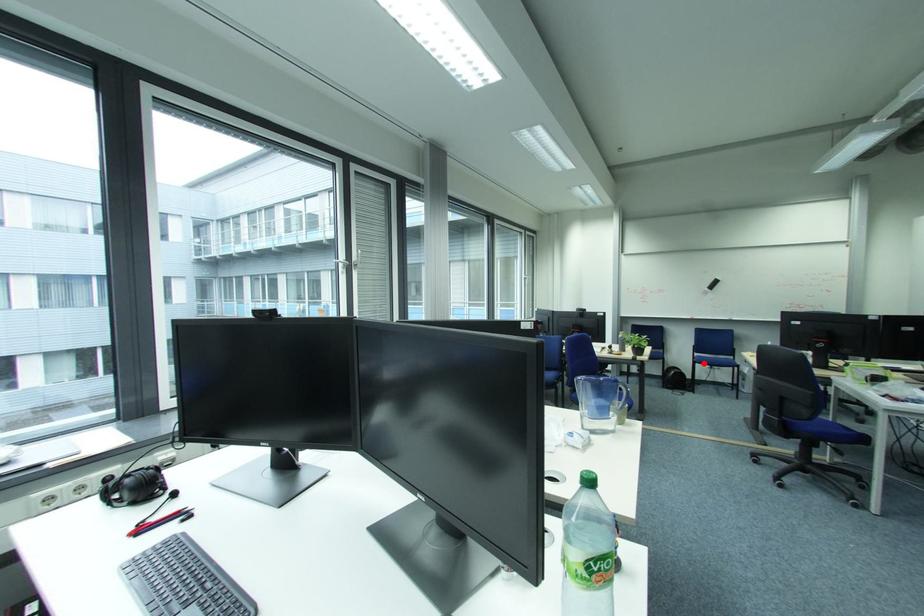
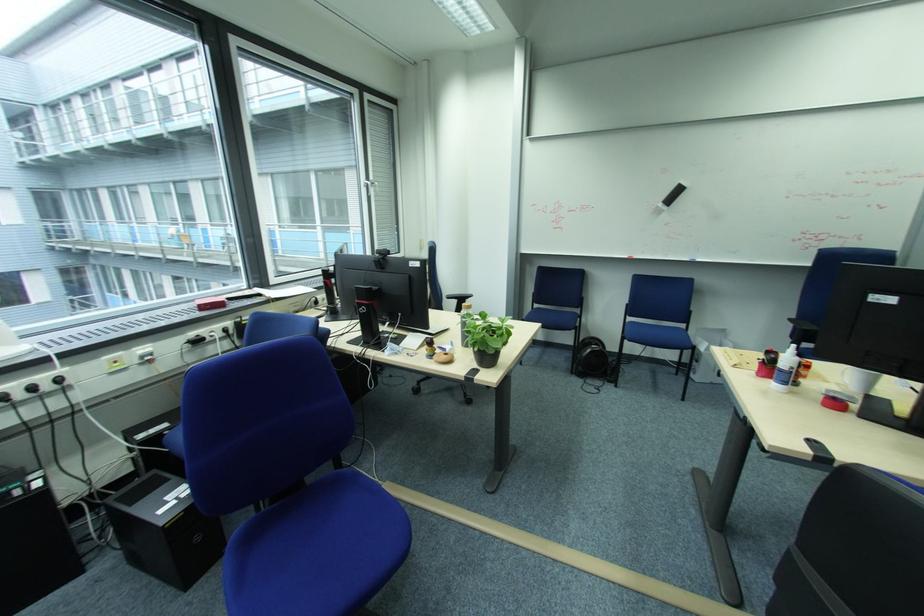
Question: I am providing you with two images of the same scene from different viewpoints. Image1 has a red point marked. In image2, the corresponding 3D location appears at what relative position? Reply with the corresponding letter.

Choices:
 (A) Closer
 (B) Farther

Answer: (A)